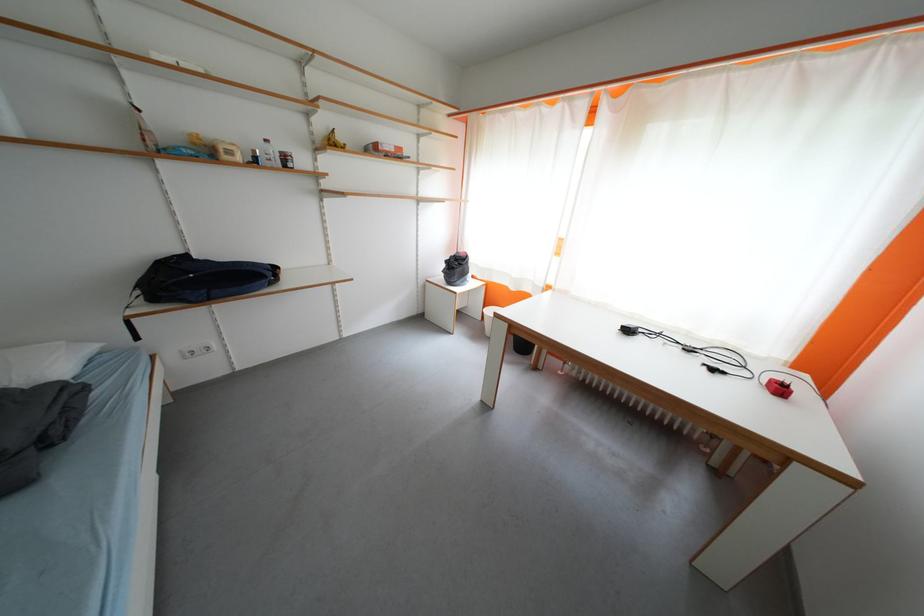
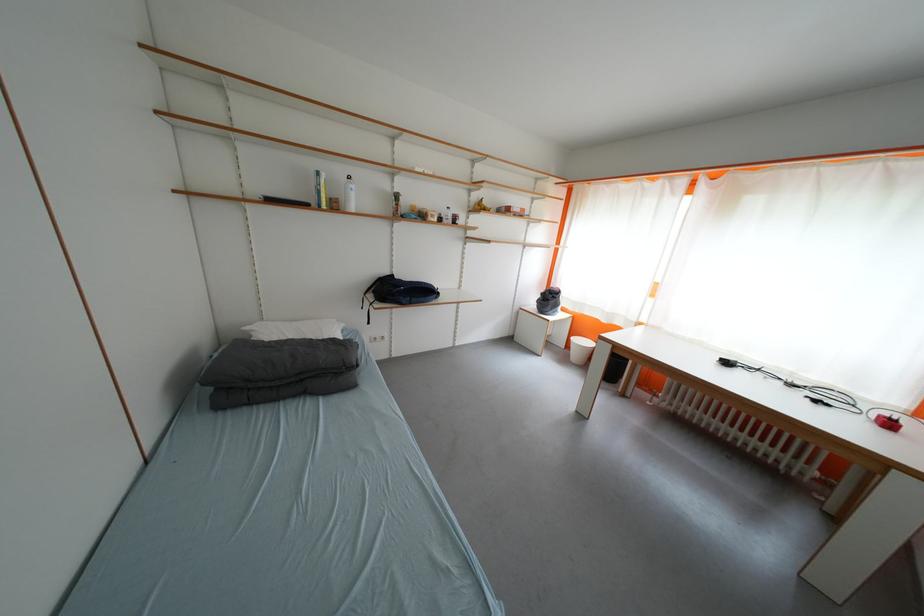
In the second image, find the point that corresponds to pixel 455 265 in the first image.

(551, 297)